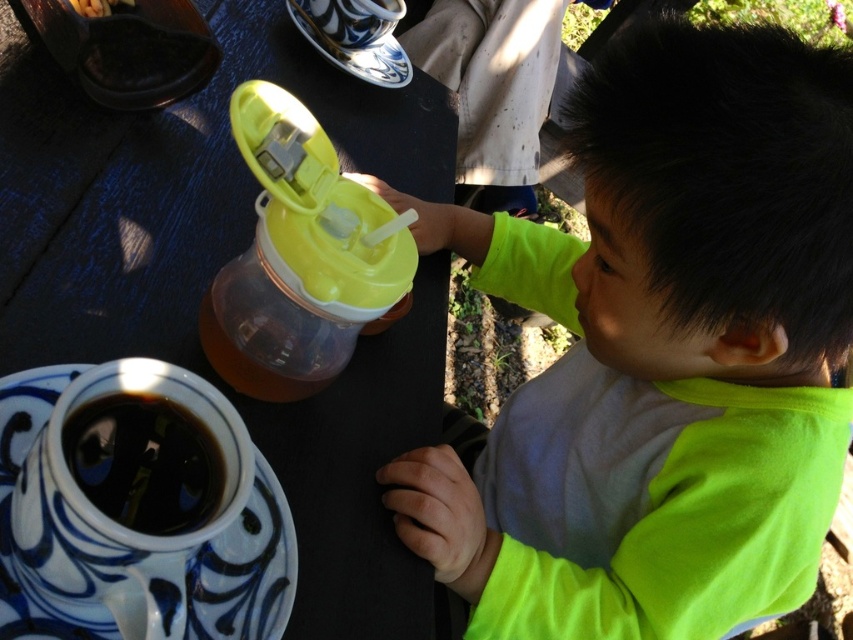
Is neon green shirt at center bigger than dark glossy coffee cup at lower left?

Yes.

Does neon green shirt at center appear under dark glossy coffee cup at lower left?

Incorrect, neon green shirt at center is not positioned below dark glossy coffee cup at lower left.

This screenshot has width=853, height=640. What do you see at coordinates (660, 355) in the screenshot? I see `neon green shirt at center` at bounding box center [660, 355].

The width and height of the screenshot is (853, 640). Find the location of `neon green shirt at center`. neon green shirt at center is located at coordinates (660, 355).

Can you confirm if blue and white ceramic saucer at lower left is positioned to the left of blue and white ceramic saucer at upper center?

Correct, you'll find blue and white ceramic saucer at lower left to the left of blue and white ceramic saucer at upper center.

Does blue and white ceramic saucer at lower left have a greater width compared to blue and white ceramic saucer at upper center?

Correct, the width of blue and white ceramic saucer at lower left exceeds that of blue and white ceramic saucer at upper center.

Is point (215, 424) farther from viewer compared to point (351, 65)?

No.

At what (x,y) coordinates should I click in order to perform the action: click on blue and white ceramic saucer at lower left. Please return your answer as a coordinate pair (x, y). Looking at the image, I should click on (131, 531).

How much distance is there between black glossy table at center and blue and white ceramic saucer at upper center?

The distance of black glossy table at center from blue and white ceramic saucer at upper center is 20.73 centimeters.

Is point (322, 436) more distant than point (381, 3)?

That is False.

Who is more distant from viewer, (225,22) or (375,81)?

Point (375,81)

The image size is (853, 640). In order to click on black glossy table at center in this screenshot , I will do click(215, 273).